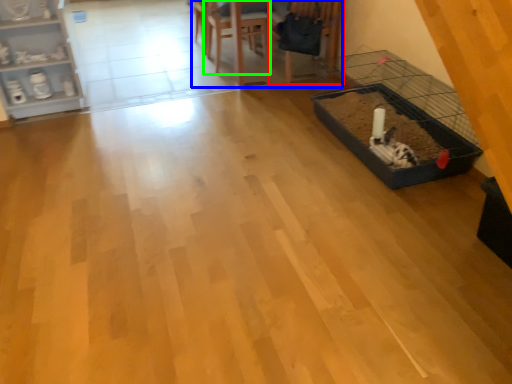
Question: Estimate the real-world distances between objects in this image. Which object is farther from armchair (highlighted by a red box), table (highlighted by a blue box) or armchair (highlighted by a green box)?

Choices:
 (A) table
 (B) armchair

Answer: (B)